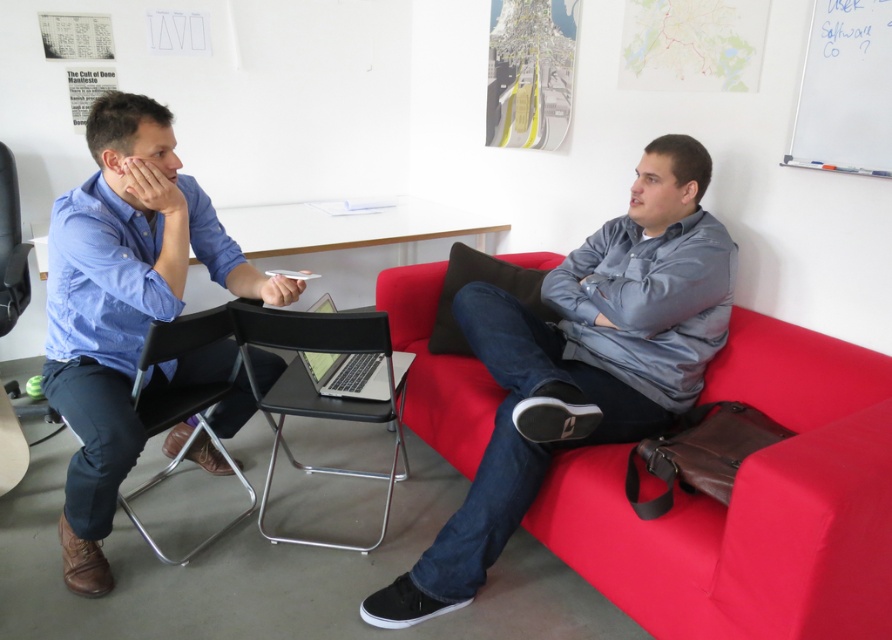
Question: Which point is closer to the camera taking this photo?

Choices:
 (A) tap(296, 320)
 (B) tap(599, 531)
 (C) tap(308, 374)
 (D) tap(89, 372)

Answer: (B)

Question: Which is farther from the black leather chair at left?

Choices:
 (A) black plastic chair at center
 (B) matte red couch at right
 (C) blue cotton shirt at left

Answer: (B)

Question: From the image, what is the correct spatial relationship of matte red couch at right in relation to black plastic chair at center?

Choices:
 (A) right
 (B) left

Answer: (A)

Question: Estimate the real-world distances between objects in this image. Which object is farther from the black leather chair at left?

Choices:
 (A) black plastic chair at center
 (B) matte red couch at right
 (C) blue cotton shirt at left

Answer: (B)

Question: Is matte red couch at right smaller than black plastic chair at center?

Choices:
 (A) yes
 (B) no

Answer: (B)

Question: Does blue cotton shirt at left lie behind black plastic chair at center?

Choices:
 (A) yes
 (B) no

Answer: (B)